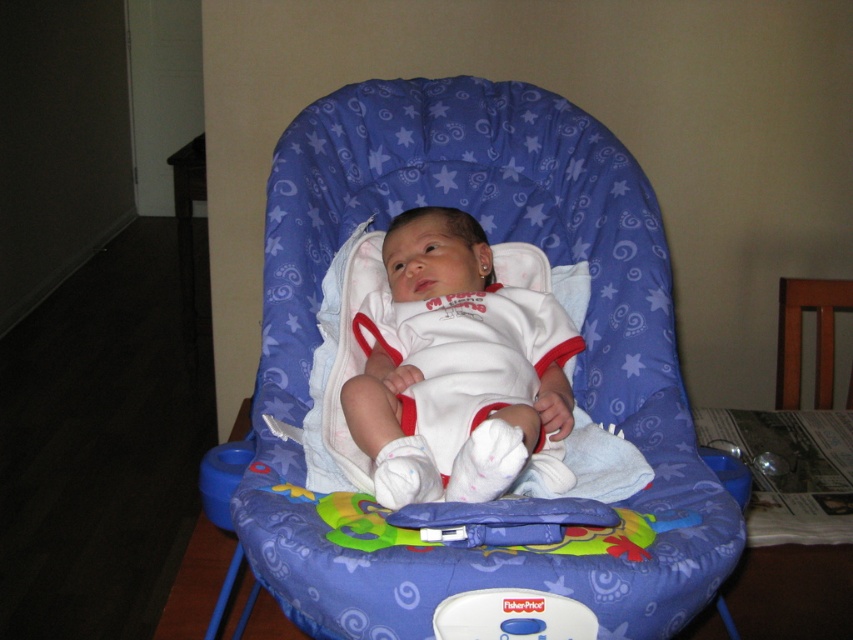
In the scene shown: Is white soft fabric baby at center wider than brown wood chair at right?

Yes.

Is point (397, 221) behind point (788, 346)?

That is False.

Identify the location of white soft fabric baby at center. This screenshot has height=640, width=853. (456, 368).

Where is `white soft fabric baby at center`? white soft fabric baby at center is located at coordinates (456, 368).

Does blue fabric baby carriage at center have a lesser width compared to brown wood chair at right?

No.

Is blue fabric baby carriage at center closer to the viewer compared to brown wood chair at right?

That is True.

The height and width of the screenshot is (640, 853). I want to click on blue fabric baby carriage at center, so click(x=550, y=262).

What do you see at coordinates (550, 262) in the screenshot? I see `blue fabric baby carriage at center` at bounding box center [550, 262].

Is point (614, 321) less distant than point (479, 636)?

No, (614, 321) is further to viewer.

Find the location of a particular element. blue fabric baby carriage at center is located at coordinates (550, 262).

You are a GUI agent. You are given a task and a screenshot of the screen. Output one action in this format:
    pyautogui.click(x=<x>, y=<y>)
    Task: Click on the blue fabric baby carriage at center
    
    Given the screenshot: What is the action you would take?
    pyautogui.click(x=550, y=262)